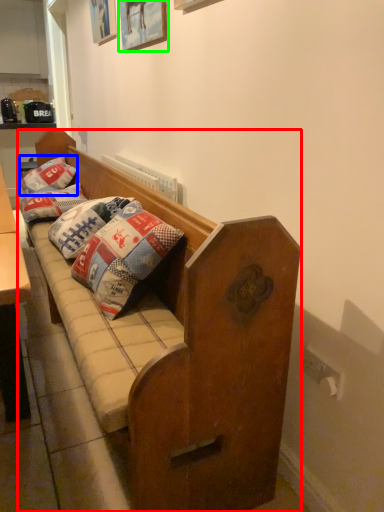
Question: Which object is the closest to the studio couch (highlighted by a red box)? Choose among these: pillow (highlighted by a blue box) or picture frame (highlighted by a green box).

Choices:
 (A) pillow
 (B) picture frame

Answer: (B)